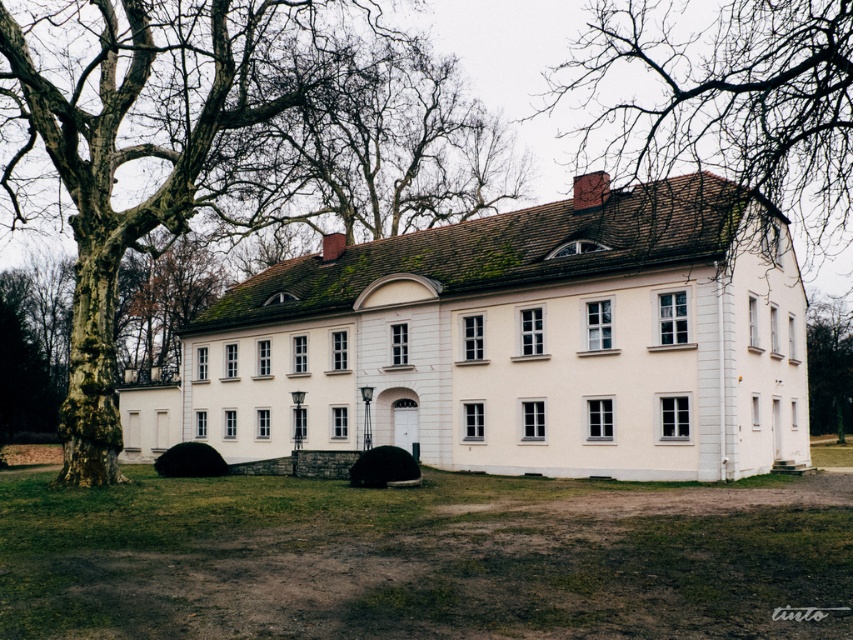
Between smooth bark tree at left and green leafy tree at right, which one is positioned higher?

Positioned higher is smooth bark tree at left.

Does point (165, 170) come in front of point (811, 428)?

That is False.

Where is `smooth bark tree at left`? smooth bark tree at left is located at coordinates (137, 148).

Based on the photo, does bare branches at upper center have a lesser width compared to green leafy tree at right?

In fact, bare branches at upper center might be wider than green leafy tree at right.

Between point (802, 189) and point (830, 323), which one is positioned behind?

Point (802, 189)

You are a GUI agent. You are given a task and a screenshot of the screen. Output one action in this format:
    pyautogui.click(x=<x>, y=<y>)
    Task: Click on the bare branches at upper center
    The height and width of the screenshot is (640, 853).
    Given the screenshot: What is the action you would take?
    pyautogui.click(x=722, y=100)

Does smooth bark tree at left appear on the left side of bare branches at upper center?

Yes, smooth bark tree at left is to the left of bare branches at upper center.

Between smooth bark tree at left and bare branches at upper center, which one is positioned lower?

smooth bark tree at left is below.

The width and height of the screenshot is (853, 640). I want to click on smooth bark tree at left, so click(137, 148).